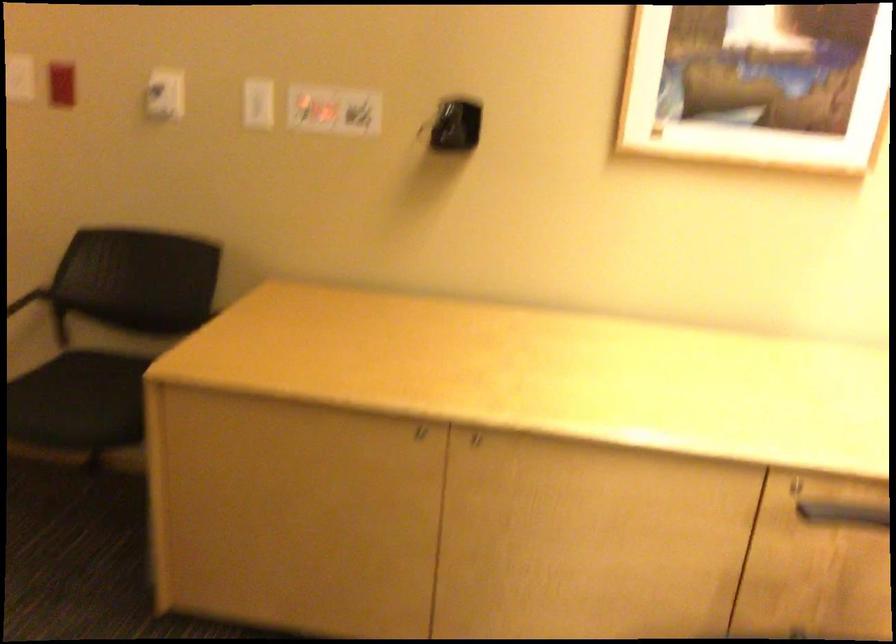
Where is `chair sitting surface`? chair sitting surface is located at coordinates (101, 373).